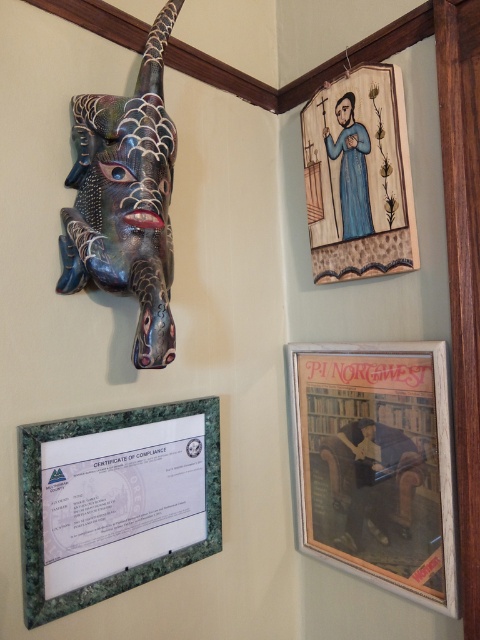
Can you confirm if wooden framed poster at lower right is smaller than wooden painted figure at upper right?

Incorrect, wooden framed poster at lower right is not smaller in size than wooden painted figure at upper right.

Is wooden framed poster at lower right wider than wooden painted figure at upper right?

Indeed, wooden framed poster at lower right has a greater width compared to wooden painted figure at upper right.

Who is more distant from viewer, (432, 531) or (381, 145)?

Point (381, 145)

You are a GUI agent. You are given a task and a screenshot of the screen. Output one action in this format:
    pyautogui.click(x=<x>, y=<y>)
    Task: Click on the wooden framed poster at lower right
    This screenshot has height=640, width=480.
    Given the screenshot: What is the action you would take?
    pyautogui.click(x=376, y=465)

Who is more forward, [132,532] or [110,163]?

Positioned in front is point [110,163].

Who is shorter, green marble certificate at lower left or metallic textured mask at upper left?

Standing shorter between the two is green marble certificate at lower left.

Which is behind, point (130, 456) or point (148, 154)?

The point (130, 456) is more distant.

You are a GUI agent. You are given a task and a screenshot of the screen. Output one action in this format:
    pyautogui.click(x=<x>, y=<y>)
    Task: Click on the green marble certificate at lower left
    
    Given the screenshot: What is the action you would take?
    pyautogui.click(x=116, y=500)

Between wooden framed poster at lower right and green marble certificate at lower left, which one has more height?

wooden framed poster at lower right

Can you confirm if wooden framed poster at lower right is positioned to the right of green marble certificate at lower left?

Correct, you'll find wooden framed poster at lower right to the right of green marble certificate at lower left.

I want to click on wooden framed poster at lower right, so click(376, 465).

Where is `wooden framed poster at lower right`? The height and width of the screenshot is (640, 480). wooden framed poster at lower right is located at coordinates (376, 465).